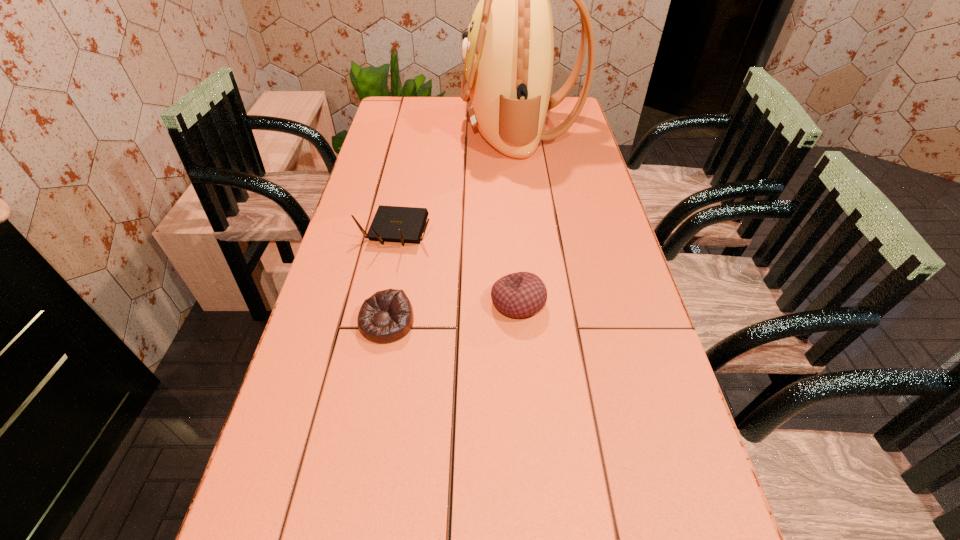
In order to click on vacant space positioned on the left of the taller beanbag in this screenshot , I will do `click(462, 302)`.

Where is `vacant point located on the back of the left beanbag`? The image size is (960, 540). vacant point located on the back of the left beanbag is located at coordinates (407, 213).

Image resolution: width=960 pixels, height=540 pixels. Identify the location of object at the far edge. 508,51.

Locate an element on the screen. router that is positioned at the left edge is located at coordinates (397, 224).

Locate an element on the screen. The image size is (960, 540). beanbag that is at the left edge is located at coordinates (387, 316).

You are a GUI agent. You are given a task and a screenshot of the screen. Output one action in this format:
    pyautogui.click(x=<x>, y=<y>)
    Task: Click on the object present at the right edge
    The height and width of the screenshot is (540, 960).
    Given the screenshot: What is the action you would take?
    pyautogui.click(x=508, y=51)

The height and width of the screenshot is (540, 960). I want to click on object present at the far right corner, so click(508, 51).

The width and height of the screenshot is (960, 540). In the image, there is a desktop. In order to click on vacant space at the left edge in this screenshot , I will do `click(341, 272)`.

This screenshot has height=540, width=960. In the image, there is a desktop. What are the coordinates of `vacant space at the right edge` in the screenshot? It's located at (580, 184).

Locate an element on the screen. The image size is (960, 540). vacant region at the far left corner of the desktop is located at coordinates (421, 116).